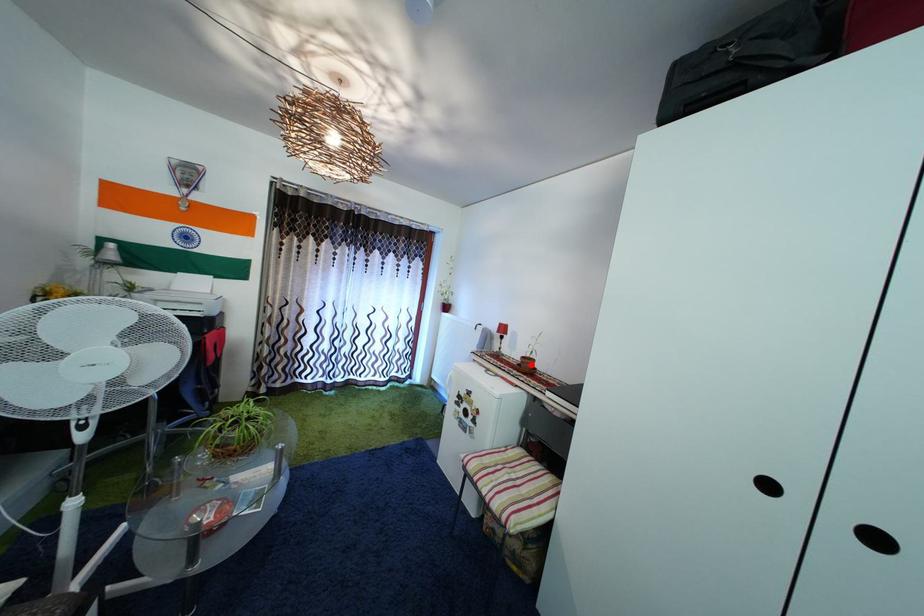
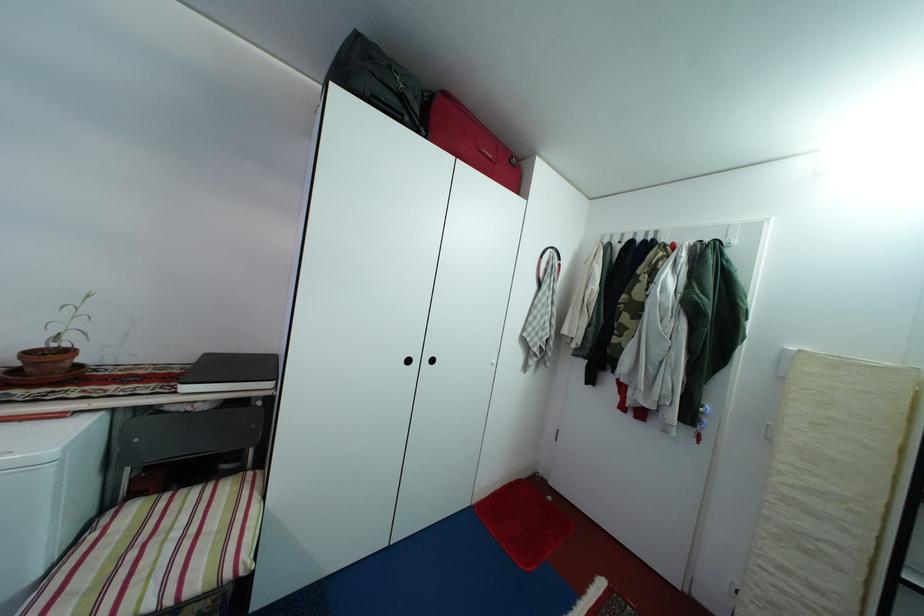
Question: I am providing you with two images of the same scene from different viewpoints. Given a red point in image1, look at the same physical point in image2. Is it:

Choices:
 (A) Closer to the viewpoint
 (B) Farther from the viewpoint

Answer: (A)